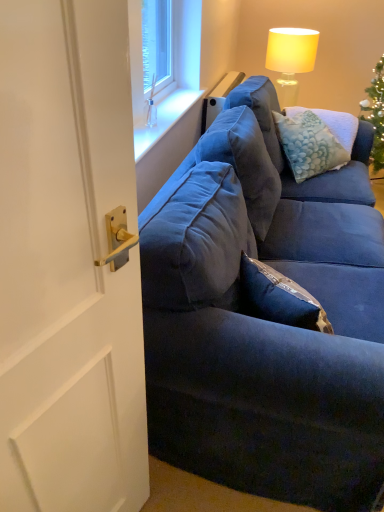
Question: Choose the correct answer: Is white glossy door handle at left inside matte yellow fabric lampshade at upper right or outside it?

Choices:
 (A) inside
 (B) outside

Answer: (B)

Question: Does point (84, 382) appear closer or farther from the camera than point (309, 60)?

Choices:
 (A) farther
 (B) closer

Answer: (B)

Question: Estimate the real-world distances between objects in this image. Which object is farther from the white glossy door handle at left?

Choices:
 (A) velvety blue pillow at upper right
 (B) matte yellow fabric lampshade at upper right
 (C) velvet blue couch at right
 (D) clear glass vase at upper center

Answer: (B)

Question: Estimate the real-world distances between objects in this image. Which object is closer to the clear glass vase at upper center?

Choices:
 (A) velvety blue pillow at upper right
 (B) velvet blue couch at right
 (C) matte yellow fabric lampshade at upper right
 (D) white glossy door handle at left

Answer: (A)